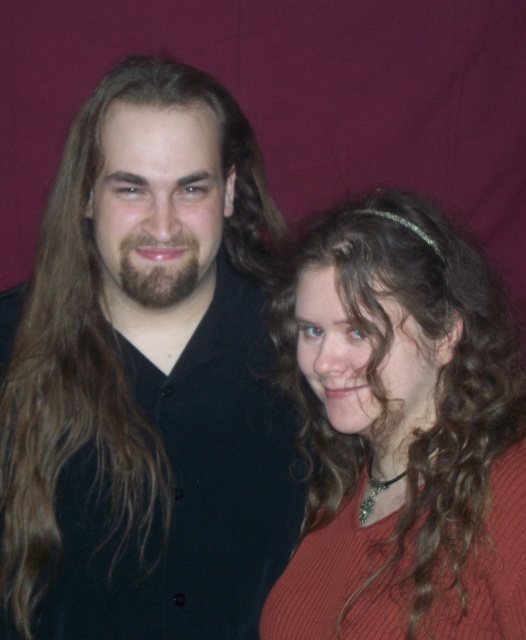
Does point (203, 384) lie behind point (347, 445)?

No, it is not.

Who is taller, matte black shirt at left or matte red sweater at right?

matte black shirt at left is taller.

Does point (294, 515) come behind point (351, 481)?

Yes.

Find the location of a particular element. The height and width of the screenshot is (640, 526). matte black shirt at left is located at coordinates (145, 381).

Does matte red sweater at right appear on the left side of brownwoollybeard at left?

Incorrect, matte red sweater at right is not on the left side of brownwoollybeard at left.

Between matte red sweater at right and brownwoollybeard at left, which one has more height?

With more height is matte red sweater at right.

You are a GUI agent. You are given a task and a screenshot of the screen. Output one action in this format:
    pyautogui.click(x=<x>, y=<y>)
    Task: Click on the matte red sweater at right
    This screenshot has height=640, width=526.
    Given the screenshot: What is the action you would take?
    pyautogui.click(x=402, y=429)

Between matte black shirt at left and brownwoollybeard at left, which one appears on the right side from the viewer's perspective?

brownwoollybeard at left is more to the right.

What are the coordinates of `matte black shirt at left` in the screenshot? It's located at (145, 381).